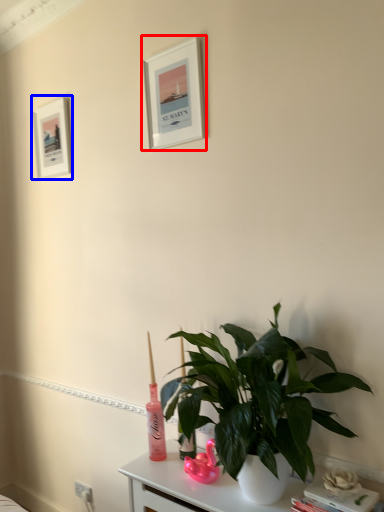
Question: Which point is further to the camera, picture frame (highlighted by a red box) or picture frame (highlighted by a blue box)?

Choices:
 (A) picture frame
 (B) picture frame

Answer: (B)